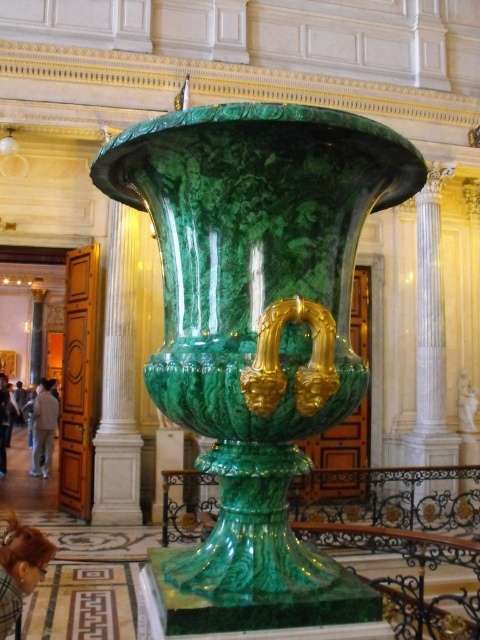
Question: Does brown hair at lower left have a larger size compared to light brown leather jacket at lower left?

Choices:
 (A) no
 (B) yes

Answer: (A)

Question: Which point is closer to the camera?

Choices:
 (A) (46, 384)
 (B) (289, 298)

Answer: (B)

Question: Estimate the real-world distances between objects in this image. Which object is closer to the brown hair at lower left?

Choices:
 (A) green marble vase at center
 (B) light brown leather jacket at lower left

Answer: (A)

Question: Can you confirm if brown hair at lower left is positioned below light brown leather jacket at lower left?

Choices:
 (A) yes
 (B) no

Answer: (B)

Question: Is brown hair at lower left bigger than light brown leather jacket at lower left?

Choices:
 (A) no
 (B) yes

Answer: (A)

Question: Estimate the real-world distances between objects in this image. Which object is closer to the light brown leather jacket at lower left?

Choices:
 (A) green marble vase at center
 (B) brown hair at lower left

Answer: (B)